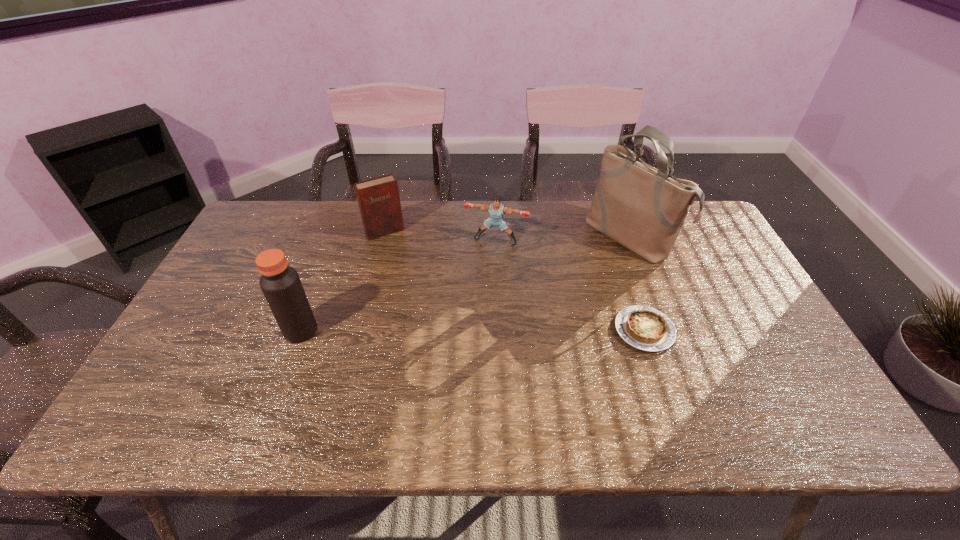
The image size is (960, 540). I want to click on vacant space that's between the leftmost object and the diary, so point(343,281).

Find the location of a particular element. The image size is (960, 540). empty space between the shoulder bag and the vinegar is located at coordinates (465, 284).

Locate an element on the screen. This screenshot has height=540, width=960. free space between the third tallest object and the quiche is located at coordinates (515, 281).

Image resolution: width=960 pixels, height=540 pixels. In order to click on free space between the shoulder bag and the puncher in this screenshot , I will do `click(563, 239)`.

This screenshot has height=540, width=960. I want to click on free spot between the quiche and the second object from left to right, so click(515, 281).

The width and height of the screenshot is (960, 540). I want to click on empty space between the tallest object and the third object from right to left, so click(563, 239).

At what (x,y) coordinates should I click in order to perform the action: click on blank region between the puncher and the shortest object. Please return your answer as a coordinate pair (x, y). This screenshot has height=540, width=960. Looking at the image, I should click on (570, 286).

Where is `free point between the vinegar and the second shortest object`? Image resolution: width=960 pixels, height=540 pixels. free point between the vinegar and the second shortest object is located at coordinates (398, 286).

Locate an element on the screen. The height and width of the screenshot is (540, 960). blank region between the vinegar and the shortest object is located at coordinates (472, 330).

Identify the location of empty space that is in between the second tallest object and the shoulder bag. (465, 284).